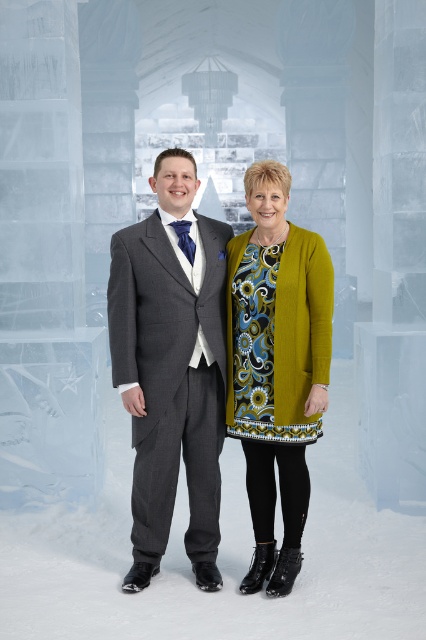
You are a photographer positioned in front of the ice structure. You need to capture a clear photo of both the gray pinstripe suit at center and the floral print jersey dress at center. Which one will appear larger in the photo?

The gray pinstripe suit at center will appear larger in the photo because it is closer to the viewer than the floral print jersey dress at center.

You are a photographer at an ice hotel event and need to capture a group photo of the matte green cardigan at center and the floral print jersey dress at center. The camera you are using has a minimum focus distance of 3 inches. Can you take a photo of both subjects without moving them?

The matte green cardigan at center and floral print jersey dress at center are 3.04 inches apart from each other. Since the camera requires a minimum focus distance of 3 inches, the subjects are just barely within range. However, due to the 0.04 inch excess, the camera should be able to focus on both without needing to move them.

You are a photographer standing 10 feet away from the gray pinstripe suit at center and the matte green cardigan at center. You want to take a photo that captures both individuals in the frame without any distortion. Given that your camera has a maximum focus range of 12 inches, can you adjust your position to ensure both are in focus?

The distance between the gray pinstripe suit at center and the matte green cardigan at center is 13.49 inches. Since your camera can only focus within 12 inches, you need to move closer so that the distance between them is within the focus range. Move approximately 1.5 feet closer to reduce the distance to under 12 inches for both to be in focus.